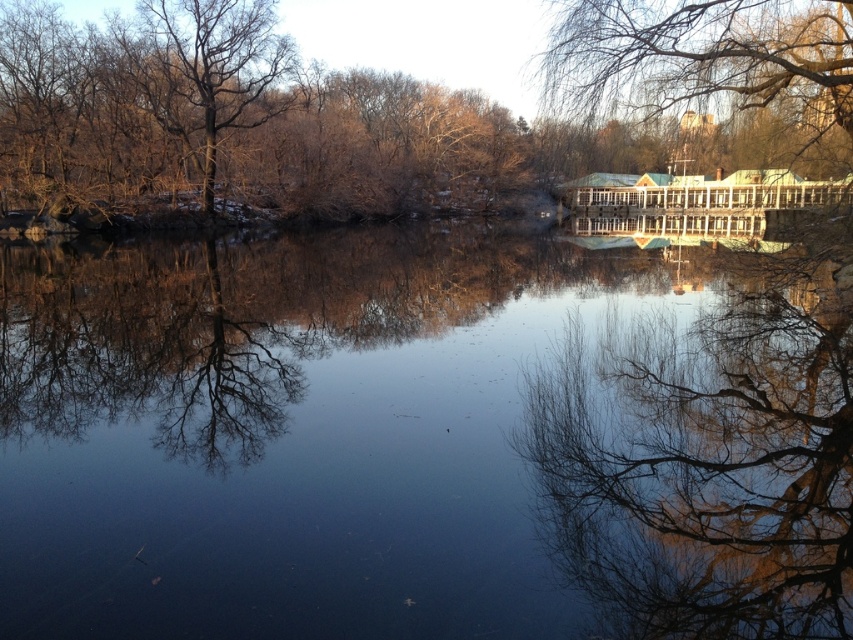
You are a landscape architect designing a new pathway between the transparent glass river at center and the green leafy tree at upper right. The pathway must be straight and 2 meters wide. Can you fit this pathway between them without making it too narrow?

The transparent glass river at center and green leafy tree at upper right are 16.29 meters apart. A 2 meter wide pathway can easily fit between them since the distance is much larger than the required width.

In the scene shown: You are an architect designing a new bridge that needs to be 2 meters tall. You observe the transparent glass river at center and the green leafy tree at upper right in the scene. Which object must you consider in terms of height to ensure the bridge can be built without obstruction?

The transparent glass river at center is taller than the green leafy tree at upper right. Therefore, you must consider the height of the transparent glass river at center to ensure the bridge can be built without obstruction as it is the taller object.